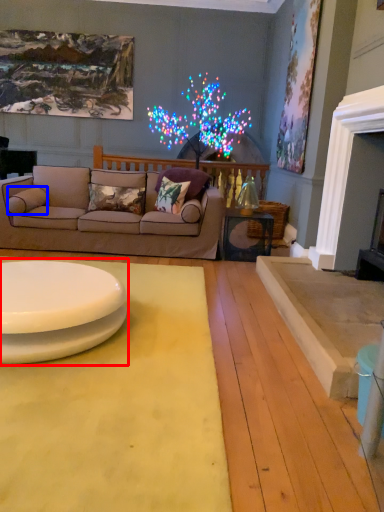
Question: Which object is further to the camera taking this photo, table (highlighted by a red box) or pillow (highlighted by a blue box)?

Choices:
 (A) table
 (B) pillow

Answer: (B)